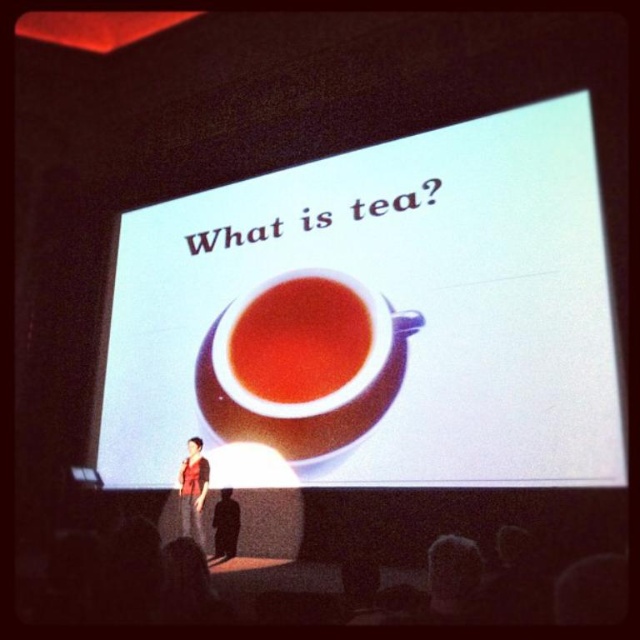
Who is positioned more to the left, red shirt at center or matte black shirt at center?

red shirt at center

Is point (196, 452) more distant than point (212, 547)?

No, it is in front of (212, 547).

At what (x,y) coordinates should I click in order to perform the action: click on red shirt at center. Please return your answer as a coordinate pair (x, y). The height and width of the screenshot is (640, 640). Looking at the image, I should click on (193, 490).

Is translucent glass cup at center below red shirt at center?

No, translucent glass cup at center is not below red shirt at center.

Is translucent glass cup at center taller than red shirt at center?

Yes, translucent glass cup at center is taller than red shirt at center.

Is point (260, 305) positioned before point (189, 456)?

That is False.

In order to click on translucent glass cup at center in this screenshot , I will do `click(300, 340)`.

Is point (296, 312) positioned before point (224, 513)?

Yes, point (296, 312) is closer to viewer.

The width and height of the screenshot is (640, 640). What are the coordinates of `translucent glass cup at center` in the screenshot? It's located at (300, 340).